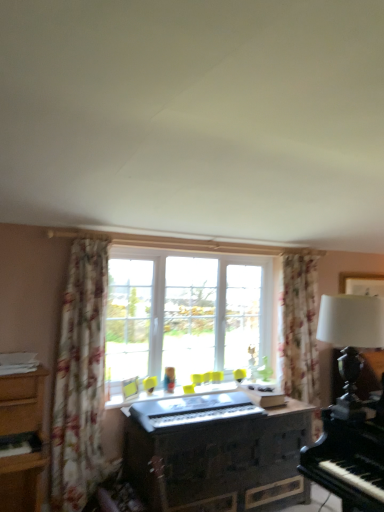
Measure the distance between floral fabric curtain at left and camera.

The depth of floral fabric curtain at left is 9.12 feet.

I want to click on white matte table lamp at right, so click(351, 341).

Consider the image. What is the approximate height of wooden dresser at center?

72.36 centimeters.

In order to click on wooden dresser at center in this screenshot , I will do `click(216, 452)`.

Where is `clear glass window at center`? Image resolution: width=384 pixels, height=512 pixels. clear glass window at center is located at coordinates (203, 309).

The width and height of the screenshot is (384, 512). Identify the location of floral fabric curtain at left. (80, 380).

Could you tell me if wooden dresser at center is facing metallic silver keyboard at center?

No, wooden dresser at center is not oriented towards metallic silver keyboard at center.

How many degrees apart are the facing directions of wooden dresser at center and metallic silver keyboard at center?

wooden dresser at center and metallic silver keyboard at center are facing 0.683 degrees away from each other.

Is wooden dresser at center far away from metallic silver keyboard at center?

No, wooden dresser at center is in close proximity to metallic silver keyboard at center.

Would you say wooden dresser at center is to the left or to the right of metallic silver keyboard at center in the picture?

Based on their positions, wooden dresser at center is located to the right of metallic silver keyboard at center.

Does white matte table lamp at right have a greater width compared to clear glass window at center?

Yes, white matte table lamp at right is wider than clear glass window at center.

Who is smaller, white matte table lamp at right or clear glass window at center?

white matte table lamp at right is smaller.

Does white matte table lamp at right have a greater height compared to clear glass window at center?

Incorrect, the height of white matte table lamp at right is not larger of that of clear glass window at center.

Find the location of `table lamp below the clear glass window at center (from a real-world perspective)`. table lamp below the clear glass window at center (from a real-world perspective) is located at coordinates (351, 341).

Considering the relative sizes of white matte table lamp at right and floral fabric curtain at left in the image provided, is white matte table lamp at right shorter than floral fabric curtain at left?

Correct, white matte table lamp at right is not as tall as floral fabric curtain at left.

Is white matte table lamp at right completely or partially outside of floral fabric curtain at left?

Yes, white matte table lamp at right is located beyond the bounds of floral fabric curtain at left.

Between white matte table lamp at right and floral fabric curtain at left, which one is positioned in front?

white matte table lamp at right.

How many degrees apart are the facing directions of white matte table lamp at right and floral fabric curtain at left?

The angular difference between white matte table lamp at right and floral fabric curtain at left is 91.4 degrees.

Can you confirm if clear glass window at center is thinner than metallic silver keyboard at center?

Correct, the width of clear glass window at center is less than that of metallic silver keyboard at center.

Between point (205, 289) and point (191, 400), which one is positioned in front?

Point (191, 400)

Considering the sizes of objects clear glass window at center and metallic silver keyboard at center in the image provided, who is shorter, clear glass window at center or metallic silver keyboard at center?

Standing shorter between the two is metallic silver keyboard at center.

Who is more distant, clear glass window at center or metallic silver keyboard at center?

clear glass window at center is further away from the camera.

Can you confirm if metallic silver keyboard at center is wider than floral fabric curtain at left?

Yes, metallic silver keyboard at center is wider than floral fabric curtain at left.

Considering the positions of points (236, 402) and (67, 413), is point (236, 402) closer to camera compared to point (67, 413)?

No, (236, 402) is behind (67, 413).

Between metallic silver keyboard at center and floral fabric curtain at left, which one has more height?

Standing taller between the two is floral fabric curtain at left.

Between metallic silver keyboard at center and white matte table lamp at right, which one is positioned in front?

Positioned in front is white matte table lamp at right.

Is metallic silver keyboard at center surrounding white matte table lamp at right?

That's incorrect, white matte table lamp at right is not inside metallic silver keyboard at center.

In terms of width, does metallic silver keyboard at center look wider or thinner when compared to white matte table lamp at right?

In the image, metallic silver keyboard at center appears to be more narrow than white matte table lamp at right.

From the image's perspective, which is below, metallic silver keyboard at center or white matte table lamp at right?

metallic silver keyboard at center is shown below in the image.

Is the position of floral fabric curtain at left more distant than that of white matte table lamp at right?

Yes, floral fabric curtain at left is further from the viewer.

Which is more to the right, floral fabric curtain at left or white matte table lamp at right?

white matte table lamp at right.

Between floral fabric curtain at left and white matte table lamp at right, which one has smaller width?

With smaller width is floral fabric curtain at left.

Which is nearer, (64, 329) or (378, 305)?

Point (64, 329).

Image resolution: width=384 pixels, height=512 pixels. What are the coordinates of `musical keyboard above the wooden dresser at center (from the image's perspective)` in the screenshot? It's located at (192, 410).

The width and height of the screenshot is (384, 512). In the image, there is a clear glass window at center. Identify the location of table lamp below it (from a real-world perspective). (x=351, y=341).

From the image, which object appears to be farther from floral fabric curtain at left, white matte table lamp at right or metallic silver keyboard at center?

white matte table lamp at right lies further to floral fabric curtain at left than the other object.

Based on their spatial positions, is floral fabric curtain at left or white matte table lamp at right further from clear glass window at center?

The object further to clear glass window at center is white matte table lamp at right.

Considering their positions, is clear glass window at center positioned closer to wooden dresser at center than white matte table lamp at right?

clear glass window at center lies closer to wooden dresser at center than the other object.

Based on their spatial positions, is metallic silver keyboard at center or white matte table lamp at right further from floral fabric curtain at left?

white matte table lamp at right is positioned further to the anchor floral fabric curtain at left.

Considering their positions, is wooden dresser at center positioned closer to metallic silver keyboard at center than clear glass window at center?

wooden dresser at center lies closer to metallic silver keyboard at center than the other object.

Estimate the real-world distances between objects in this image. Which object is further from clear glass window at center, wooden dresser at center or white matte table lamp at right?

white matte table lamp at right is positioned further to the anchor clear glass window at center.

From the image, which object appears to be nearer to metallic silver keyboard at center, white matte table lamp at right or floral fabric curtain at left?

floral fabric curtain at left is closer to metallic silver keyboard at center.

Which object lies nearer to the anchor point metallic silver keyboard at center, clear glass window at center or floral fabric curtain at left?

Among the two, floral fabric curtain at left is located nearer to metallic silver keyboard at center.

Find the location of `musical keyboard positioned between white matte table lamp at right and clear glass window at center from near to far`. musical keyboard positioned between white matte table lamp at right and clear glass window at center from near to far is located at coordinates (192, 410).

Locate an element on the screen. This screenshot has height=512, width=384. musical keyboard between clear glass window at center and wooden dresser at center vertically is located at coordinates pos(192,410).

The height and width of the screenshot is (512, 384). Find the location of `dresser between floral fabric curtain at left and white matte table lamp at right in the horizontal direction`. dresser between floral fabric curtain at left and white matte table lamp at right in the horizontal direction is located at coordinates (216, 452).

The width and height of the screenshot is (384, 512). I want to click on window situated between floral fabric curtain at left and white matte table lamp at right from left to right, so click(x=203, y=309).